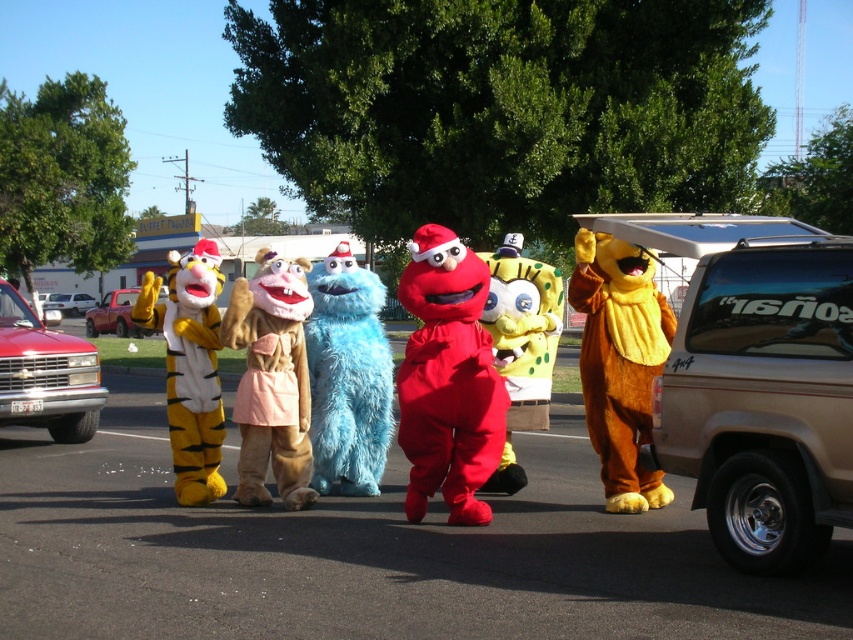
You are a delivery driver who needs to park your truck in the parking lot shown. You see the tan metallic truck at right and the metallic red truck at left. Which truck should you avoid parking behind to ensure your vehicle has enough space to exit without hitting another vehicle?

You should avoid parking behind the metallic red truck at left because the tan metallic truck at right is positioned under it, indicating it is closer to you. Parking behind the metallic red truck at left would leave less space between your vehicle and the tan metallic truck at right, potentially causing a collision when exiting.

You are a photographer trying to capture a photo of the fuzzy blue monster at center and the matte red truck at left. Based on their positions, which one would you need to focus on first if you are standing at ground level looking upward?

The matte red truck at left is higher up than the fuzzy blue monster at center, so you should focus on the matte red truck at left first if you are looking upward from ground level.

You are a delivery driver who needs to park your truck in a parking lot where there is a yellow and white plush tiger at left and a matte red truck at left. The parking lot has a 120 feet width. Can your truck, which is 10 feet wide, fit between the two vehicles without touching them?

The distance between the yellow and white plush tiger at left and the matte red truck at left is 116.17 feet. Subtracting the width of both vehicles, the available space is 116.17 feet minus the combined width of the tiger and truck. However, since the exact widths of the tiger and truck aren